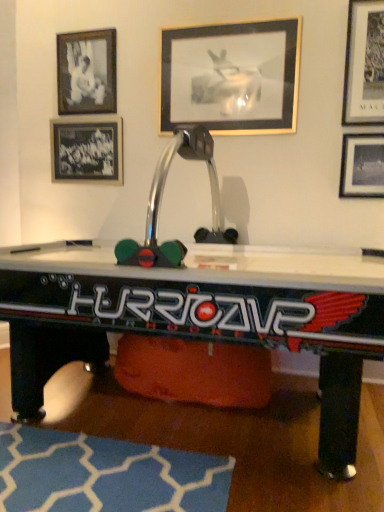
Question: Is metallic silver picture frame at upper right, positioned as the 4th picture frame in left-to-right order, at the back of blue fabric rug at lower center?

Choices:
 (A) no
 (B) yes

Answer: (A)

Question: Does blue fabric rug at lower center come in front of metallic silver picture frame at upper right, which is the 2th picture frame in right-to-left order?

Choices:
 (A) no
 (B) yes

Answer: (B)

Question: Can you confirm if blue fabric rug at lower center is smaller than metallic silver picture frame at upper right, which is the 2th picture frame in right-to-left order?

Choices:
 (A) yes
 (B) no

Answer: (B)

Question: Is blue fabric rug at lower center further to the viewer compared to metallic silver picture frame at upper right, positioned as the 4th picture frame in left-to-right order?

Choices:
 (A) yes
 (B) no

Answer: (B)

Question: Would you say blue fabric rug at lower center is a long distance from metallic silver picture frame at upper right, which is the 2th picture frame in right-to-left order?

Choices:
 (A) no
 (B) yes

Answer: (B)

Question: Can we say blue fabric rug at lower center lies outside metallic silver picture frame at upper right, which is the 2th picture frame in right-to-left order?

Choices:
 (A) no
 (B) yes

Answer: (B)

Question: Would you consider black glass picture frame at upper left, the 1th picture frame when ordered from left to right, to be distant from metallic silver picture frame at upper right, placed as the 1th picture frame when sorted from right to left?

Choices:
 (A) no
 (B) yes

Answer: (B)

Question: Are black glass picture frame at upper left, the 1th picture frame when ordered from left to right, and metallic silver picture frame at upper right, marked as the 5th picture frame in a left-to-right arrangement, making contact?

Choices:
 (A) no
 (B) yes

Answer: (A)

Question: Can you confirm if black glass picture frame at upper left, the 1th picture frame when ordered from left to right, is positioned to the left of metallic silver picture frame at upper right, marked as the 5th picture frame in a left-to-right arrangement?

Choices:
 (A) no
 (B) yes

Answer: (B)

Question: Does black glass picture frame at upper left, the 1th picture frame when ordered from left to right, have a greater width compared to metallic silver picture frame at upper right, placed as the 1th picture frame when sorted from right to left?

Choices:
 (A) yes
 (B) no

Answer: (B)

Question: Considering the relative sizes of black glass picture frame at upper left, the 1th picture frame when ordered from left to right, and metallic silver picture frame at upper right, placed as the 1th picture frame when sorted from right to left, in the image provided, is black glass picture frame at upper left, the 1th picture frame when ordered from left to right, bigger than metallic silver picture frame at upper right, placed as the 1th picture frame when sorted from right to left,?

Choices:
 (A) yes
 (B) no

Answer: (A)

Question: From a real-world perspective, is black glass picture frame at upper left, marked as the 5th picture frame in a right-to-left arrangement, physically below metallic silver picture frame at upper right, placed as the 1th picture frame when sorted from right to left?

Choices:
 (A) yes
 (B) no

Answer: (B)

Question: Can you confirm if blue fabric rug at lower center is positioned to the right of metallic silver air hockey table at center?

Choices:
 (A) yes
 (B) no

Answer: (B)